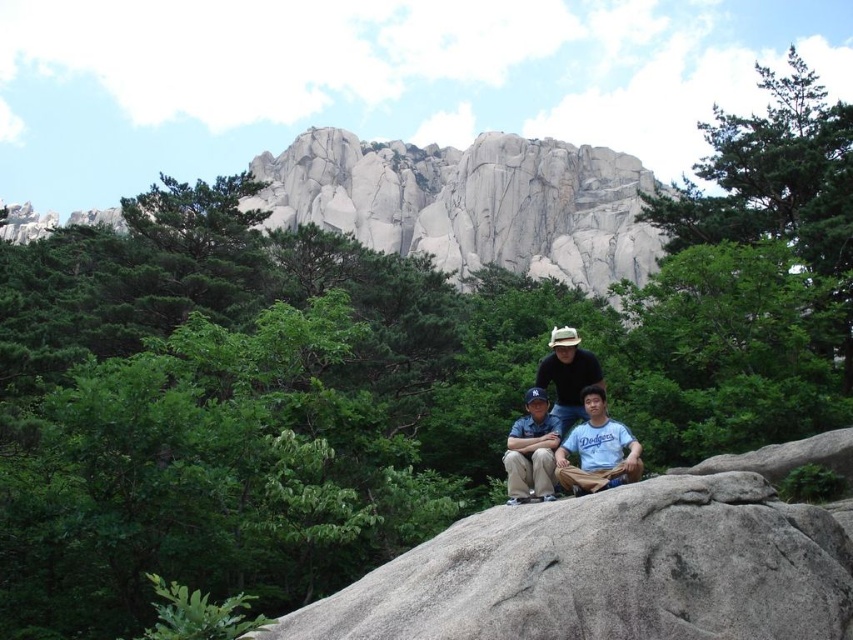
You are standing in front of the granite rock formation at upper center and the matte brown hat at center. Which object is closer to you?

The granite rock formation at upper center is closer to you because it is positioned further to the viewer than the matte brown hat at center.